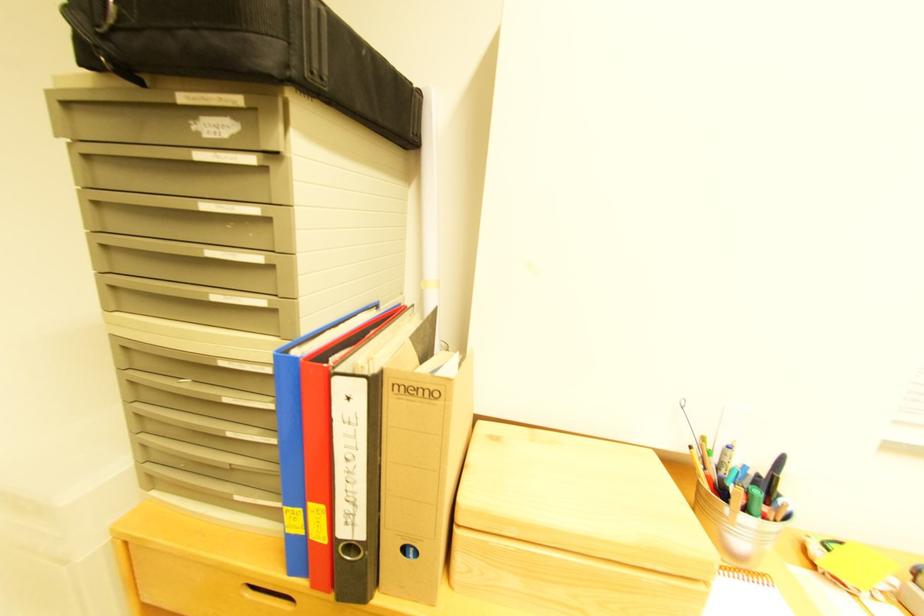
Find where to lift the blue binder. Please return your answer as a coordinate pair (x, y).

(299, 431)